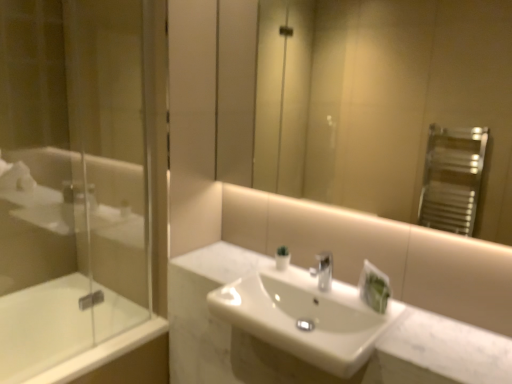
Question: From the image's perspective, is white glossy sink at center above or below matte glass mirror at upper center?

Choices:
 (A) above
 (B) below

Answer: (B)

Question: Considering the positions of white glossy sink at center and matte glass mirror at upper center in the image, is white glossy sink at center wider or thinner than matte glass mirror at upper center?

Choices:
 (A) thin
 (B) wide

Answer: (B)

Question: Based on their relative distances, which object is farther from the white glossy sink at center?

Choices:
 (A) white glossy bathtub at lower left
 (B) matte glass mirror at upper center
 (C) transparent glass shower door at left

Answer: (B)

Question: Which of these objects is positioned farthest from the transparent glass shower door at left?

Choices:
 (A) white glossy sink at center
 (B) white glossy bathtub at lower left
 (C) matte glass mirror at upper center

Answer: (C)